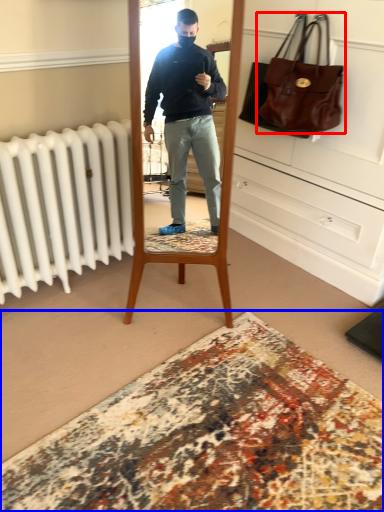
Question: Which of the following is the farthest to the observer, handbag (highlighted by a red box) or plain (highlighted by a blue box)?

Choices:
 (A) handbag
 (B) plain

Answer: (A)